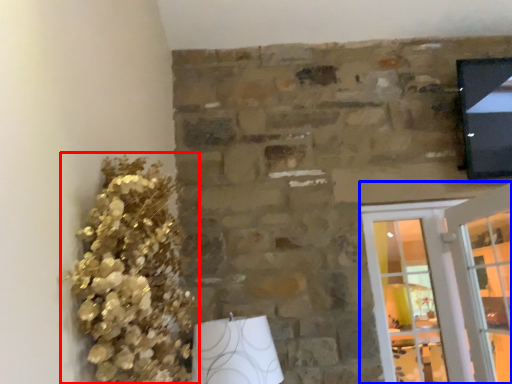
Question: Which object appears closest to the camera in this image, floral arrangement (highlighted by a red box) or screen door (highlighted by a blue box)?

Choices:
 (A) floral arrangement
 (B) screen door

Answer: (A)